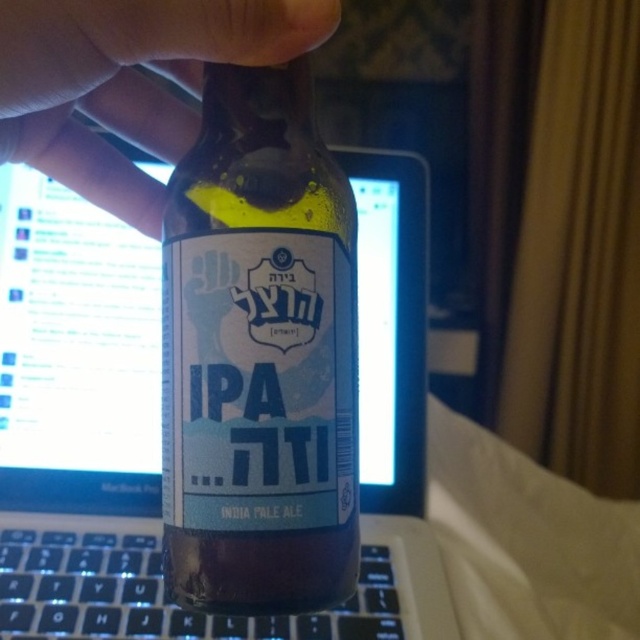
Question: Among these objects, which one is farthest from the camera?

Choices:
 (A) glossy plastic computer screen at center
 (B) black plastic keyboard at lower left
 (C) translucent plastic hand at upper left
 (D) matte skin at upper left

Answer: (A)

Question: Does clear glass ipa at center appear under glossy plastic computer screen at center?

Choices:
 (A) no
 (B) yes

Answer: (A)

Question: Which point appears farthest from the camera in this image?

Choices:
 (A) (403, 173)
 (B) (90, 588)
 (C) (195, 3)

Answer: (A)

Question: Does matte skin at upper left appear under black plastic keyboard at lower left?

Choices:
 (A) yes
 (B) no

Answer: (B)

Question: Which of the following is the farthest from the observer?

Choices:
 (A) (275, 20)
 (B) (108, 492)
 (C) (227, 618)
 (D) (301, 51)

Answer: (B)

Question: Is the position of clear glass ipa at center less distant than that of glossy plastic computer screen at center?

Choices:
 (A) yes
 (B) no

Answer: (A)